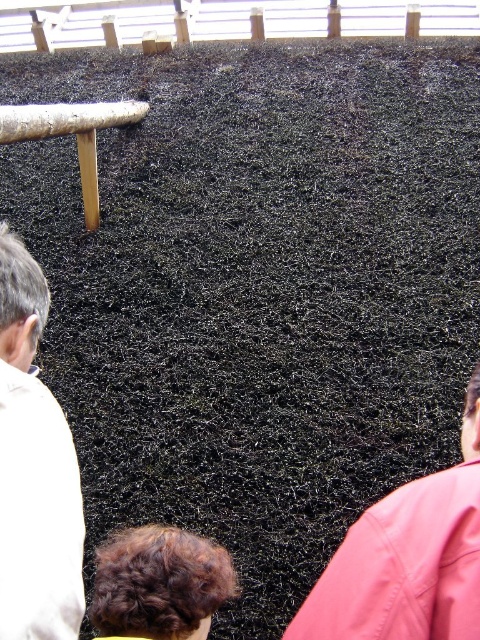
You are standing in a field and see a white fabric shirt at left and a brown curly hair at lower center. Which one is closer to you?

The white fabric shirt at left is closer to you because it is only 18.95 inches away from the brown curly hair at lower center, which is farther away.

You are standing in front of a large pile of dark fibrous material. You see a pink fabric at lower right and a brown curly hair at lower center. Which object is positioned more to the east?

The pink fabric at lower right is positioned more to the east than the brown curly hair at lower center.